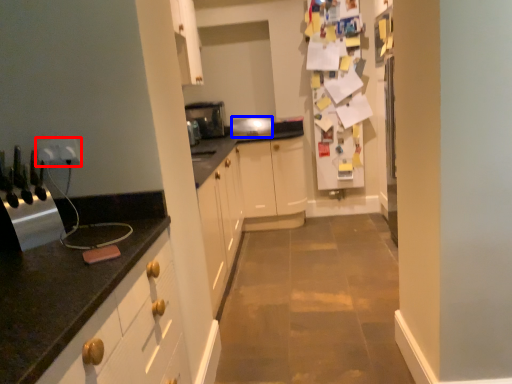
Question: Which point is closer to the camera, electric outlet (highlighted by a red box) or appliance (highlighted by a blue box)?

Choices:
 (A) electric outlet
 (B) appliance

Answer: (A)